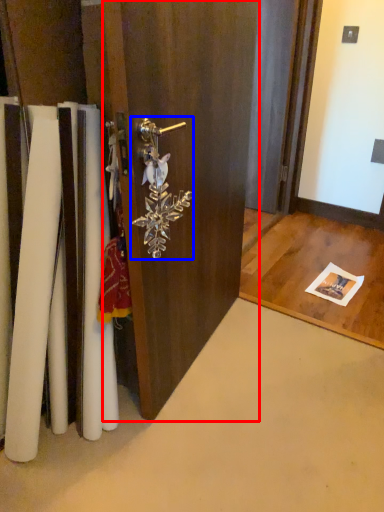
Question: Among these objects, which one is farthest to the camera, door (highlighted by a red box) or door handle (highlighted by a blue box)?

Choices:
 (A) door
 (B) door handle

Answer: (B)